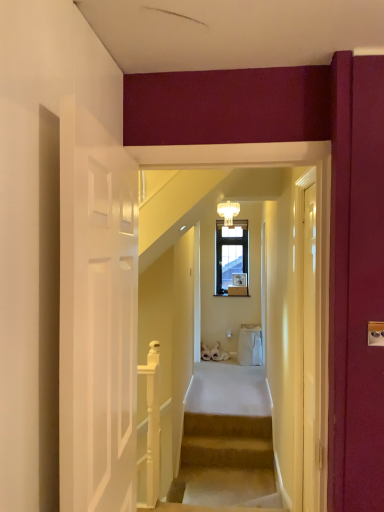
Question: Is the depth of clear glass door at right greater than that of white glossy wooden handrail at lower left?

Choices:
 (A) no
 (B) yes

Answer: (A)

Question: Considering the relative positions of clear glass door at right and white glossy wooden handrail at lower left in the image provided, is clear glass door at right to the right of white glossy wooden handrail at lower left from the viewer's perspective?

Choices:
 (A) yes
 (B) no

Answer: (A)

Question: From the image's perspective, is clear glass door at right above white glossy wooden handrail at lower left?

Choices:
 (A) yes
 (B) no

Answer: (A)

Question: Is clear glass door at right positioned in front of white glossy wooden handrail at lower left?

Choices:
 (A) yes
 (B) no

Answer: (A)

Question: From a real-world perspective, is clear glass door at right positioned over white glossy wooden handrail at lower left based on gravity?

Choices:
 (A) no
 (B) yes

Answer: (B)

Question: In the image, is clear glass door at right positioned in front of or behind translucent glass chandelier at upper center?

Choices:
 (A) behind
 (B) front

Answer: (B)

Question: From the image's perspective, is clear glass door at right above or below translucent glass chandelier at upper center?

Choices:
 (A) above
 (B) below

Answer: (B)

Question: In terms of size, does clear glass door at right appear bigger or smaller than translucent glass chandelier at upper center?

Choices:
 (A) small
 (B) big

Answer: (B)

Question: Considering the positions of clear glass door at right and translucent glass chandelier at upper center in the image, is clear glass door at right wider or thinner than translucent glass chandelier at upper center?

Choices:
 (A) thin
 (B) wide

Answer: (A)

Question: Looking at the image, does translucent glass chandelier at upper center seem bigger or smaller compared to clear glass door at right?

Choices:
 (A) small
 (B) big

Answer: (A)

Question: Is point (221, 207) positioned closer to the camera than point (319, 177)?

Choices:
 (A) closer
 (B) farther

Answer: (B)

Question: From their relative heights in the image, would you say translucent glass chandelier at upper center is taller or shorter than clear glass door at right?

Choices:
 (A) short
 (B) tall

Answer: (A)

Question: From the image's perspective, relative to clear glass door at right, is translucent glass chandelier at upper center above or below?

Choices:
 (A) below
 (B) above

Answer: (B)

Question: From their relative heights in the image, would you say white glossy wooden handrail at lower left is taller or shorter than translucent glass chandelier at upper center?

Choices:
 (A) short
 (B) tall

Answer: (B)

Question: Looking at their shapes, would you say white glossy wooden handrail at lower left is wider or thinner than translucent glass chandelier at upper center?

Choices:
 (A) wide
 (B) thin

Answer: (B)